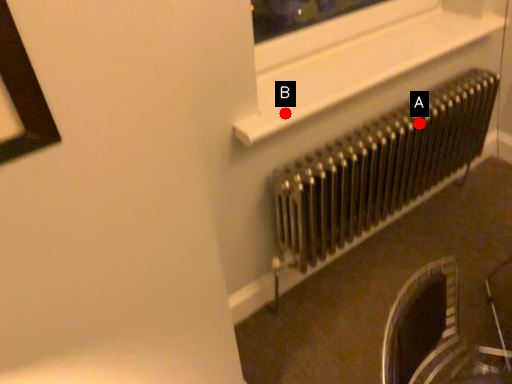
Question: Two points are circled on the image, labeled by A and B beside each circle. Which point is further to the camera?

Choices:
 (A) A is further
 (B) B is further

Answer: (A)